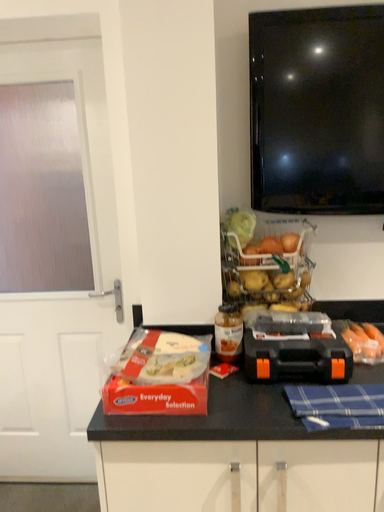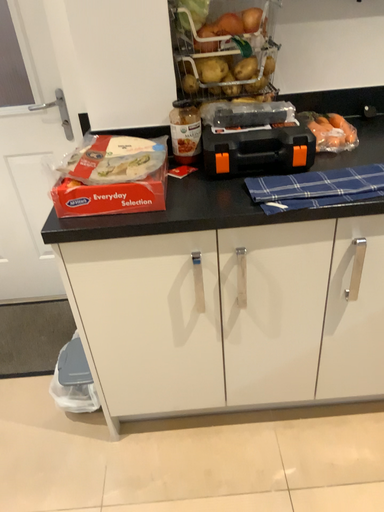
Question: How did the camera likely rotate when shooting the video?

Choices:
 (A) rotated downward
 (B) rotated upward

Answer: (A)